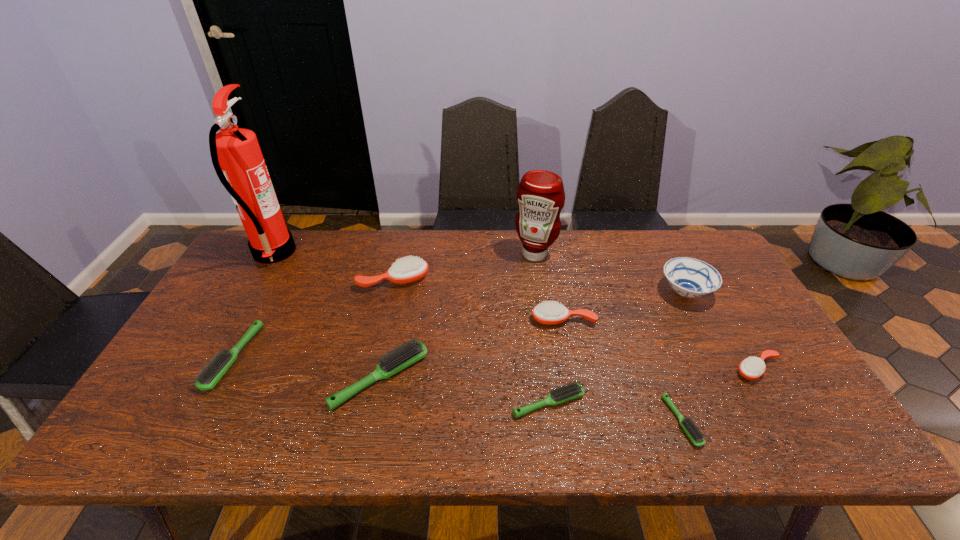
This screenshot has height=540, width=960. What are the coordinates of `vacant space at the near right corner of the desktop` in the screenshot? It's located at (830, 449).

The width and height of the screenshot is (960, 540). Find the location of `empty space that is in between the third object from right to left and the blue soup bowl`. empty space that is in between the third object from right to left and the blue soup bowl is located at coordinates (684, 357).

Identify the location of empty location between the third smallest light hairbrush and the rightmost light hairbrush. (457, 389).

This screenshot has height=540, width=960. What are the coordinates of `empty space between the soup bowl and the third object from right to left` in the screenshot? It's located at (684, 357).

Locate an element on the screen. This screenshot has width=960, height=540. unoccupied position between the red fire extinguisher and the ninth shortest object is located at coordinates (404, 254).

Locate an element on the screen. This screenshot has height=540, width=960. free space between the soup bowl and the second smallest orange hairbrush is located at coordinates (624, 306).

The image size is (960, 540). Find the location of `vacant area that lies between the soup bowl and the leftmost orange hairbrush`. vacant area that lies between the soup bowl and the leftmost orange hairbrush is located at coordinates (540, 286).

The image size is (960, 540). In order to click on empty space between the second orange hairbrush from right to left and the red fire extinguisher in this screenshot , I will do `click(419, 286)`.

The height and width of the screenshot is (540, 960). In order to click on free spot between the second biggest orange hairbrush and the biggest light hairbrush in this screenshot , I will do `click(471, 349)`.

I want to click on vacant space that is in between the second light hairbrush from left to right and the shortest object, so click(531, 400).